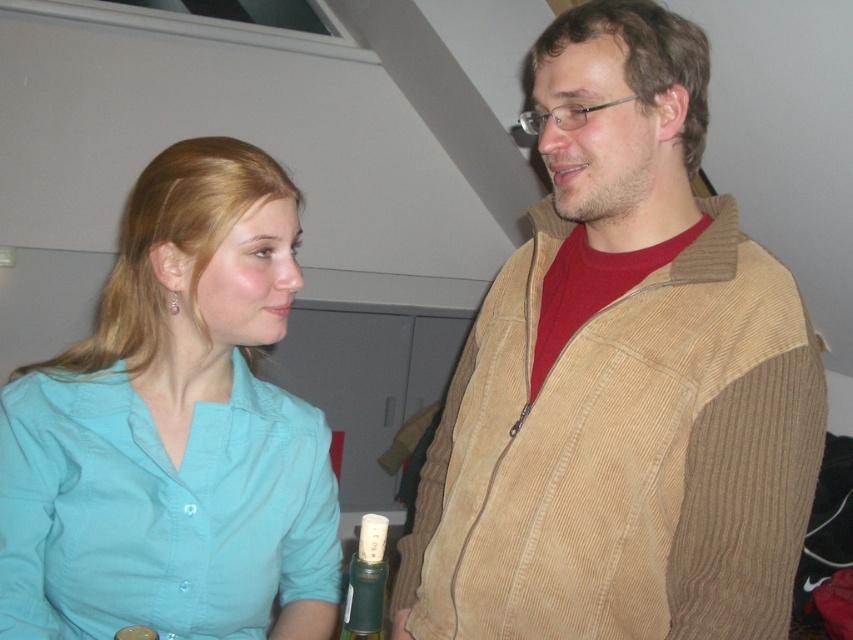
Between corduroy jacket at right and green matte bottle at lower center, which one is positioned lower?

green matte bottle at lower center is lower down.

Which is behind, point (548, 83) or point (369, 563)?

The point (548, 83) is behind.

Where is `corduroy jacket at right`? corduroy jacket at right is located at coordinates 621,381.

Does teal shirt at center have a lesser height compared to green matte bottle at lower center?

Incorrect, teal shirt at center's height does not fall short of green matte bottle at lower center's.

Who is lower down, teal shirt at center or green matte bottle at lower center?

Positioned lower is green matte bottle at lower center.

Who is more forward, [285,316] or [352,577]?

Point [352,577] is more forward.

The height and width of the screenshot is (640, 853). What are the coordinates of `teal shirt at center` in the screenshot? It's located at (173, 428).

Does point (515, 637) come behind point (276, 308)?

Yes, it is behind point (276, 308).

Who is more distant from viewer, (772, 625) or (276, 536)?

The point (276, 536) is behind.

Is point (492, 369) behind point (163, 353)?

Yes, point (492, 369) is farther from viewer.

Find the location of a particular element. The height and width of the screenshot is (640, 853). corduroy jacket at right is located at coordinates (621, 381).